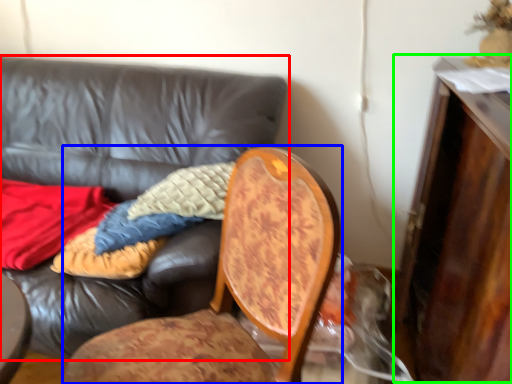
Question: Which object is the closest to the studio couch (highlighted by a red box)? Choose among these: chair (highlighted by a blue box) or dresser (highlighted by a green box).

Choices:
 (A) chair
 (B) dresser

Answer: (A)